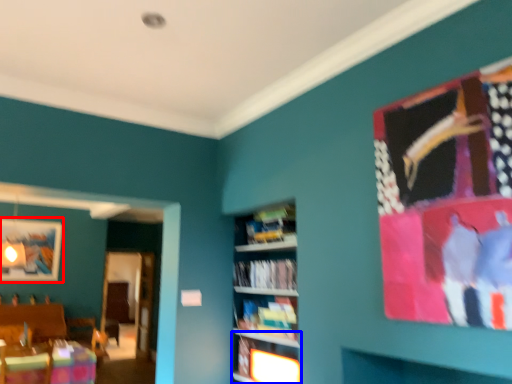
Question: Which object is further to the camera taking this photo, picture frame (highlighted by a red box) or shelf (highlighted by a blue box)?

Choices:
 (A) picture frame
 (B) shelf

Answer: (A)